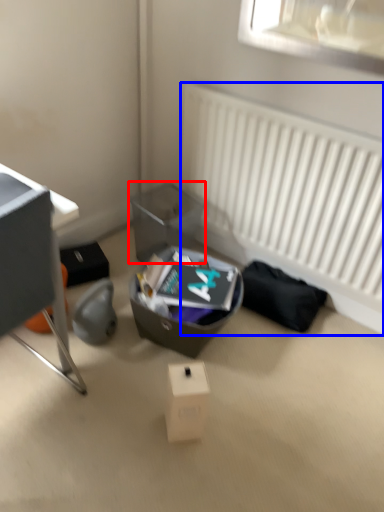
Question: Which of the following is the farthest to the observer, shoe box (highlighted by a red box) or radiator (highlighted by a blue box)?

Choices:
 (A) shoe box
 (B) radiator

Answer: (A)